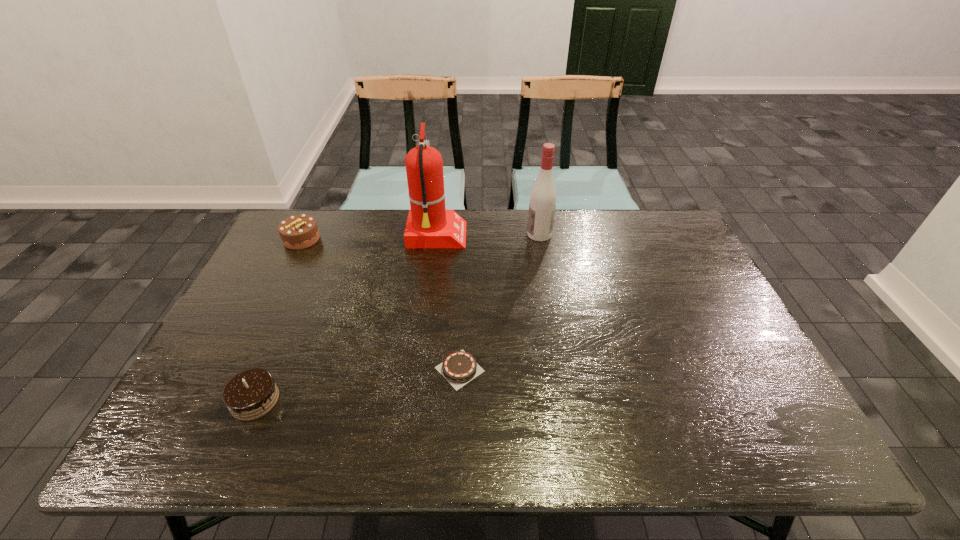
Locate which chocolate cake ranks second in proximity to the shortest chocolate cake. Please provide its 2D coordinates. Your answer should be formatted as a tuple, i.e. [(x, y)], where the tuple contains the x and y coordinates of a point satisfying the conditions above.

[(297, 232)]